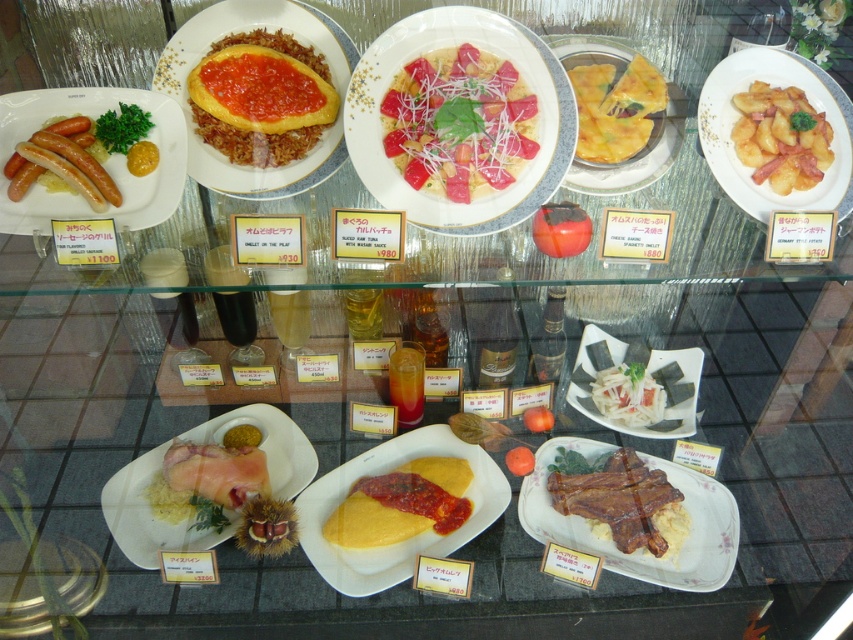
You are a customer at a buffet and want to take a photo of both the yellowish matte potatoes at upper right and the yellow matte pancake at center. Since the display case has a reflective surface, you need to ensure both items are in focus. Which item should you focus on first to capture both in the photo?

You should focus on the yellowish matte potatoes at upper right first because it is closer to the viewer than the yellow matte pancake at center, so adjusting focus from near to far will help both items be in focus.